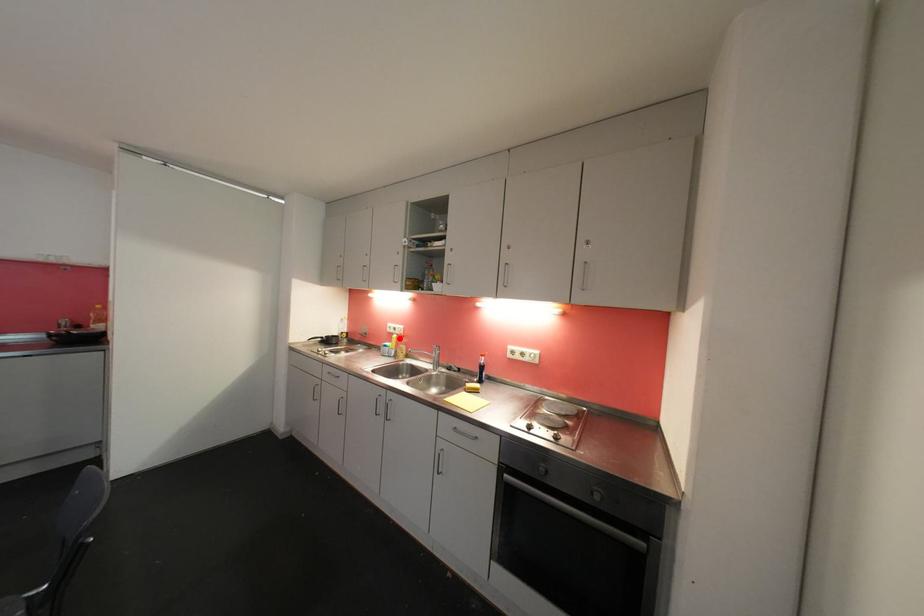
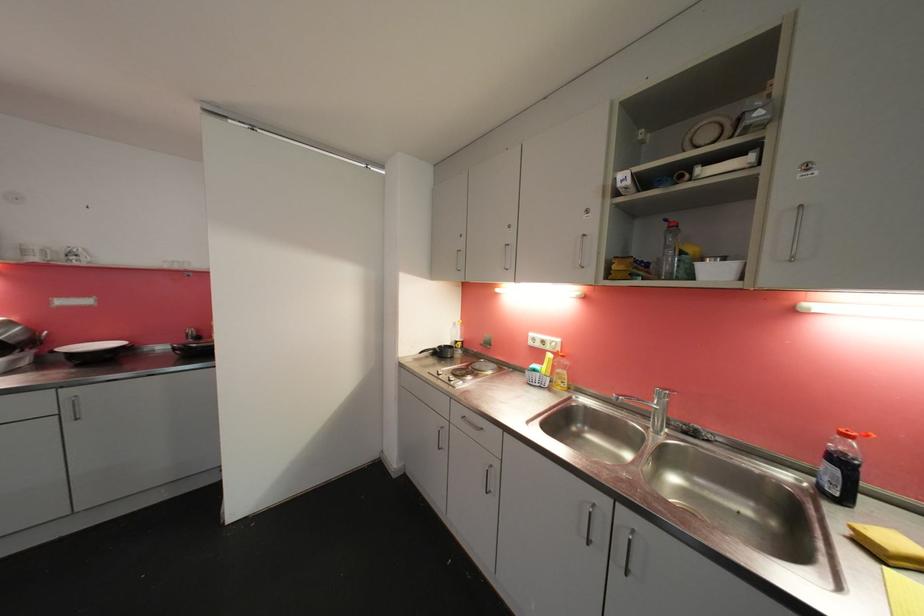
Find the pixel in the second image that matches the highlighted location in the first image.

(554, 358)